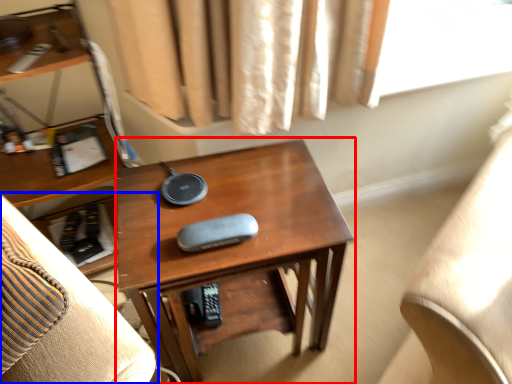
Question: Among these objects, which one is nearest to the camera, desk (highlighted by a red box) or furniture (highlighted by a blue box)?

Choices:
 (A) desk
 (B) furniture

Answer: (B)